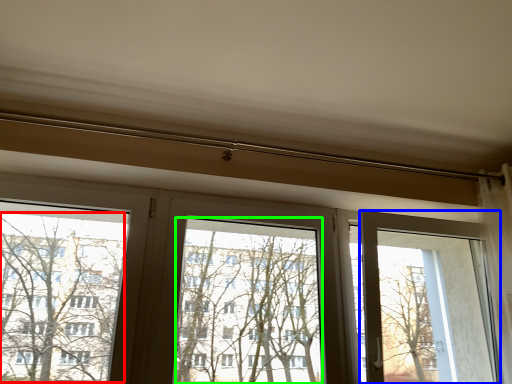
Question: Based on their relative distances, which object is farther from tree (highlighted by a red box)? Choose from screen door (highlighted by a blue box) and window screen (highlighted by a green box).

Choices:
 (A) screen door
 (B) window screen

Answer: (A)